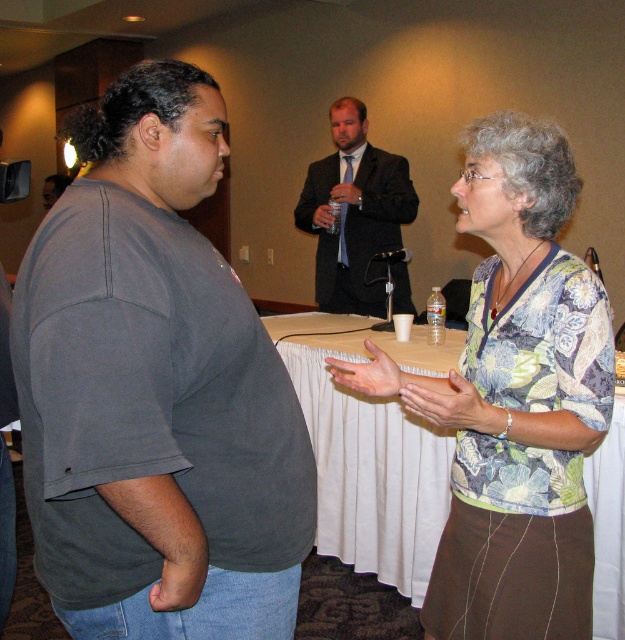
You are standing in the conference room and want to walk towards the point closer to the camera between the two points labeled point (x=112, y=500) and point (x=551, y=227). Which point should you walk towards?

You should walk towards point (x=112, y=500) because it is closer to the camera than point (x=551, y=227).